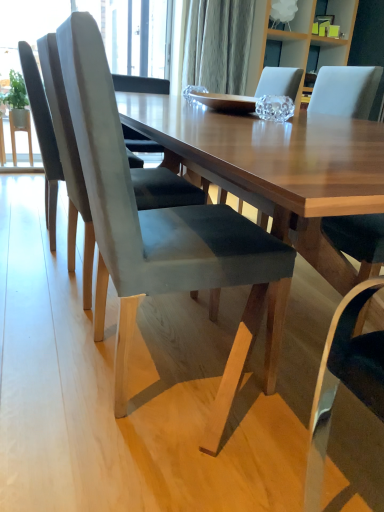
Locate an element on the screen. vacant region in front of suede gray chair at left, arranged as the 2th chair when viewed from the front is located at coordinates (63, 335).